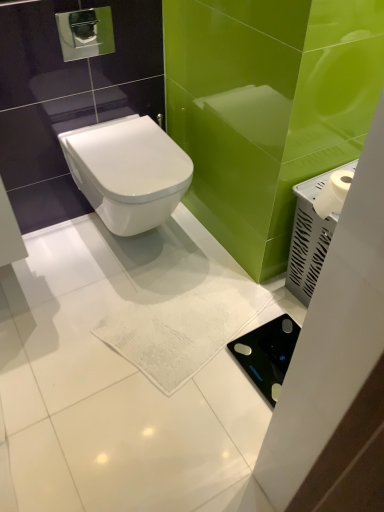
Question: Does white glossy toilet at center appear on the right side of white plastic tissue holder at right?

Choices:
 (A) yes
 (B) no

Answer: (B)

Question: Does white glossy toilet at center lie in front of white plastic tissue holder at right?

Choices:
 (A) no
 (B) yes

Answer: (A)

Question: Does white glossy toilet at center have a greater height compared to white plastic tissue holder at right?

Choices:
 (A) yes
 (B) no

Answer: (B)

Question: Is white glossy toilet at center bigger than white plastic tissue holder at right?

Choices:
 (A) no
 (B) yes

Answer: (B)

Question: Is white glossy toilet at center at the left side of white plastic tissue holder at right?

Choices:
 (A) no
 (B) yes

Answer: (B)

Question: Does white glossy toilet at center turn towards white plastic tissue holder at right?

Choices:
 (A) yes
 (B) no

Answer: (B)

Question: Considering the relative sizes of white plastic tissue holder at right and white glossy toilet at center in the image provided, is white plastic tissue holder at right thinner than white glossy toilet at center?

Choices:
 (A) no
 (B) yes

Answer: (B)

Question: From the image's perspective, is white plastic tissue holder at right under white glossy toilet at center?

Choices:
 (A) no
 (B) yes

Answer: (B)

Question: From a real-world perspective, is white plastic tissue holder at right located beneath white glossy toilet at center?

Choices:
 (A) yes
 (B) no

Answer: (A)

Question: Does white plastic tissue holder at right have a greater width compared to white glossy toilet at center?

Choices:
 (A) yes
 (B) no

Answer: (B)

Question: Considering the relative sizes of white plastic tissue holder at right and white glossy toilet at center in the image provided, is white plastic tissue holder at right shorter than white glossy toilet at center?

Choices:
 (A) no
 (B) yes

Answer: (A)

Question: From a real-world perspective, is white plastic tissue holder at right physically above white glossy toilet at center?

Choices:
 (A) yes
 (B) no

Answer: (B)

Question: From a real-world perspective, relative to white glossy toilet at center, is white plastic tissue holder at right vertically above or below?

Choices:
 (A) above
 (B) below

Answer: (B)